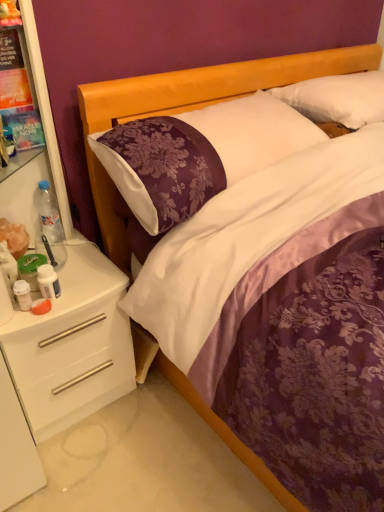
At what (x,y) coordinates should I click in order to perform the action: click on clear plastic bottle at left, the 3th bottle when ordered from top to bottom. Please return your answer as a coordinate pair (x, y). The height and width of the screenshot is (512, 384). Looking at the image, I should click on (23, 294).

The height and width of the screenshot is (512, 384). What do you see at coordinates (201, 151) in the screenshot?
I see `purple satin pillow at center, the 1th pillow viewed from the left` at bounding box center [201, 151].

What are the coordinates of `white soft pillow at upper right, marked as the 2th pillow in a left-to-right arrangement` in the screenshot? It's located at (338, 98).

What do you see at coordinates (338, 98) in the screenshot? The height and width of the screenshot is (512, 384). I see `white soft pillow at upper right, which is the 1th pillow from right to left` at bounding box center [338, 98].

The width and height of the screenshot is (384, 512). What are the coordinates of `clear plastic bottle at left, positioned as the first bottle in top-to-bottom order` in the screenshot? It's located at (49, 227).

In order to face clear plastic bottle at left, positioned as the first bottle in top-to-bottom order, should I rotate leftwards or rightwards?

Turn left approximately 18.446 degrees to face it.

Find the location of a particular element. purple satin bed at center is located at coordinates (192, 106).

In the scene shown: From a real-world perspective, is purple satin pillow at center, which is the 2th pillow from right to left, positioned over white plastic shelf at left based on gravity?

No, from a real-world perspective, purple satin pillow at center, which is the 2th pillow from right to left, is not above white plastic shelf at left.

Is point (180, 116) closer to viewer compared to point (43, 365)?

No.

Relative to white plastic shelf at left, is purple satin pillow at center, the 1th pillow viewed from the left, in front or behind?

Clearly, purple satin pillow at center, the 1th pillow viewed from the left, is behind white plastic shelf at left.

Consider the image. Is purple satin pillow at center, the 1th pillow viewed from the left, inside the boundaries of purple satin bed at center, or outside?

The correct answer is: inside.

From the image's perspective, which is below, purple satin pillow at center, the 1th pillow viewed from the left, or purple satin bed at center?

From the image's view, purple satin bed at center is below.

From a real-world perspective, is purple satin pillow at center, which is the 2th pillow from right to left, physically above purple satin bed at center?

Correct, in the physical world, purple satin pillow at center, which is the 2th pillow from right to left, is higher than purple satin bed at center.

Where is `the 2nd bottle below the white plastic shelf at left (from the image's perspective)`? the 2nd bottle below the white plastic shelf at left (from the image's perspective) is located at coordinates (48, 282).

Is white plastic shelf at left beside white plastic bottle at left, which is counted as the second bottle, starting from the bottom?

white plastic shelf at left and white plastic bottle at left, which is counted as the second bottle, starting from the bottom, are not in contact.

From the image's perspective, between white plastic shelf at left and white plastic bottle at left, the 2th bottle viewed from the back, which one is located above?

white plastic shelf at left is shown above in the image.

Is white plastic shelf at left thinner than white plastic bottle at left, the 2th bottle in the front-to-back sequence?

No.

Is white glossy drawer at lower left closer to camera compared to white soft pillow at upper right, which is the 1th pillow from right to left?

Yes, white glossy drawer at lower left is in front of white soft pillow at upper right, which is the 1th pillow from right to left.

Is white glossy drawer at lower left oriented towards white soft pillow at upper right, marked as the 2th pillow in a left-to-right arrangement?

No.

How different are the orientations of white glossy drawer at lower left and white soft pillow at upper right, marked as the 2th pillow in a left-to-right arrangement, in degrees?

The angular difference between white glossy drawer at lower left and white soft pillow at upper right, marked as the 2th pillow in a left-to-right arrangement, is 2.51 degrees.

Is white glossy drawer at lower left shorter than white soft pillow at upper right, which is the 1th pillow from right to left?

In fact, white glossy drawer at lower left may be taller than white soft pillow at upper right, which is the 1th pillow from right to left.

Consider the image. What's the angular difference between purple satin bed at center and white glossy drawer at lower left's facing directions?

The angle between the facing direction of purple satin bed at center and the facing direction of white glossy drawer at lower left is 1.82 degrees.

Looking at their sizes, would you say purple satin bed at center is wider or thinner than white glossy drawer at lower left?

In the image, purple satin bed at center appears to be wider than white glossy drawer at lower left.

Is purple satin bed at center looking in the opposite direction of white glossy drawer at lower left?

No, white glossy drawer at lower left is not at the back of purple satin bed at center.

Between purple satin bed at center and white glossy drawer at lower left, which one has less height?

Standing shorter between the two is white glossy drawer at lower left.

Between point (58, 336) and point (371, 119), which one is positioned in front?

Point (58, 336)

Considering the relative positions of white plastic shelf at left and white soft pillow at upper right, which is the 1th pillow from right to left, in the image provided, is white plastic shelf at left to the left of white soft pillow at upper right, which is the 1th pillow from right to left, from the viewer's perspective?

Indeed, white plastic shelf at left is positioned on the left side of white soft pillow at upper right, which is the 1th pillow from right to left.

Is white soft pillow at upper right, which is the 1th pillow from right to left, surrounded by white plastic shelf at left?

Actually, white soft pillow at upper right, which is the 1th pillow from right to left, is outside white plastic shelf at left.

Locate an element on the screen. Image resolution: width=384 pixels, height=512 pixels. shelf in front of the white soft pillow at upper right, which is the 1th pillow from right to left is located at coordinates (72, 345).

Is white plastic shelf at left completely or partially inside white soft pillow at upper right, which is the 1th pillow from right to left?

No, white soft pillow at upper right, which is the 1th pillow from right to left, does not contain white plastic shelf at left.

Are white soft pillow at upper right, which is the 1th pillow from right to left, and white plastic shelf at left making contact?

No, white soft pillow at upper right, which is the 1th pillow from right to left, is not next to white plastic shelf at left.

Image resolution: width=384 pixels, height=512 pixels. There is a white plastic shelf at left. Identify the location of the 1st pillow above it (from the image's perspective). (201, 151).

Where is `pillow to the left of purple satin bed at center`? Image resolution: width=384 pixels, height=512 pixels. pillow to the left of purple satin bed at center is located at coordinates (201, 151).

From the image, which object appears to be nearer to white glossy drawer at lower left, purple satin pillow at center, which is the 2th pillow from right to left, or white plastic bottle at left, which is counted as the second bottle, starting from the bottom?

white plastic bottle at left, which is counted as the second bottle, starting from the bottom, lies closer to white glossy drawer at lower left than the other object.

When comparing their distances from clear plastic bottle at left, which is the 1th bottle from front to back, does white plastic shelf at left or purple satin bed at center seem further?

purple satin bed at center is positioned further to the anchor clear plastic bottle at left, which is the 1th bottle from front to back.

Considering their positions, is white plastic shelf at left positioned further to purple satin pillow at center, the 1th pillow viewed from the left, than clear plastic bottle at left, positioned as the first bottle in top-to-bottom order?

clear plastic bottle at left, positioned as the first bottle in top-to-bottom order, is positioned further to the anchor purple satin pillow at center, the 1th pillow viewed from the left.

Based on their spatial positions, is purple satin pillow at center, which is the 2th pillow from right to left, or purple satin bed at center closer to white plastic shelf at left?

purple satin bed at center lies closer to white plastic shelf at left than the other object.

Looking at the image, which one is located further to clear plastic bottle at left, the 3th bottle from the bottom, clear plastic bottle at left, which is the 1th bottle from front to back, or white plastic bottle at left, which is counted as the second bottle, starting from the bottom?

clear plastic bottle at left, which is the 1th bottle from front to back, is positioned further to the anchor clear plastic bottle at left, the 3th bottle from the bottom.

Looking at the image, which one is located further to clear plastic bottle at left, placed as the first bottle when sorted from back to front, purple satin bed at center or white glossy drawer at lower left?

Among the two, purple satin bed at center is located further to clear plastic bottle at left, placed as the first bottle when sorted from back to front.

From the image, which object appears to be nearer to white plastic shelf at left, white plastic bottle at left, the 2th bottle from the top, or purple satin pillow at center, which is the 2th pillow from right to left?

white plastic bottle at left, the 2th bottle from the top, lies closer to white plastic shelf at left than the other object.

From the image, which object appears to be farther from clear plastic bottle at left, which is the 1th bottle from front to back, clear plastic bottle at left, the 3th bottle from the bottom, or white soft pillow at upper right, marked as the 2th pillow in a left-to-right arrangement?

white soft pillow at upper right, marked as the 2th pillow in a left-to-right arrangement, lies further to clear plastic bottle at left, which is the 1th bottle from front to back, than the other object.

The image size is (384, 512). I want to click on drawer between clear plastic bottle at left, placed as the first bottle when sorted from back to front, and white soft pillow at upper right, marked as the 2th pillow in a left-to-right arrangement, so click(x=70, y=365).

I want to click on pillow between clear plastic bottle at left, which is the first bottle from bottom to top, and purple satin bed at center from left to right, so click(x=201, y=151).

Where is `bottle between white plastic shelf at left and white plastic bottle at left, the 2th bottle in the front-to-back sequence, in the front-back direction`? Image resolution: width=384 pixels, height=512 pixels. bottle between white plastic shelf at left and white plastic bottle at left, the 2th bottle in the front-to-back sequence, in the front-back direction is located at coordinates (23, 294).

Locate an element on the screen. Image resolution: width=384 pixels, height=512 pixels. bottle between clear plastic bottle at left, the third bottle in the back-to-front sequence, and purple satin bed at center, in the horizontal direction is located at coordinates (48, 282).